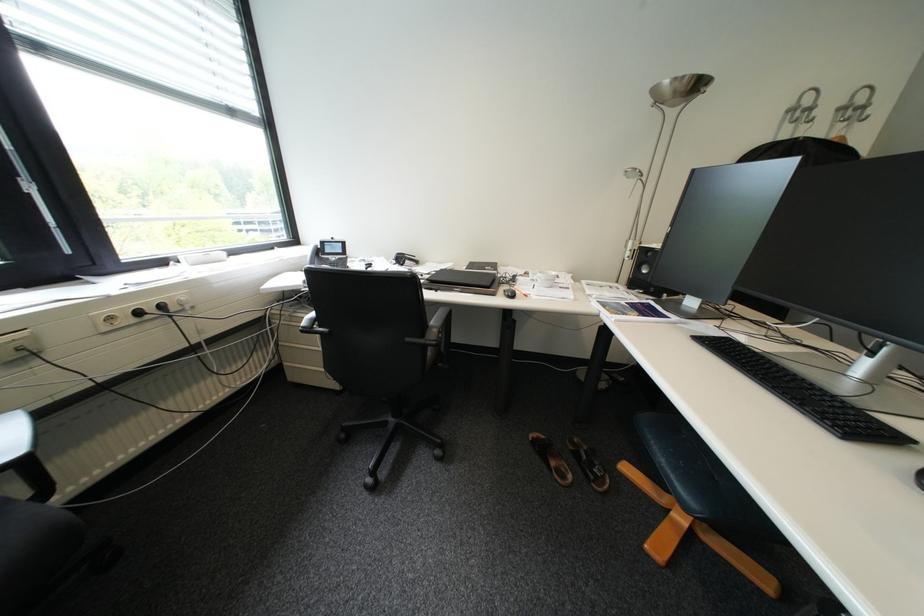
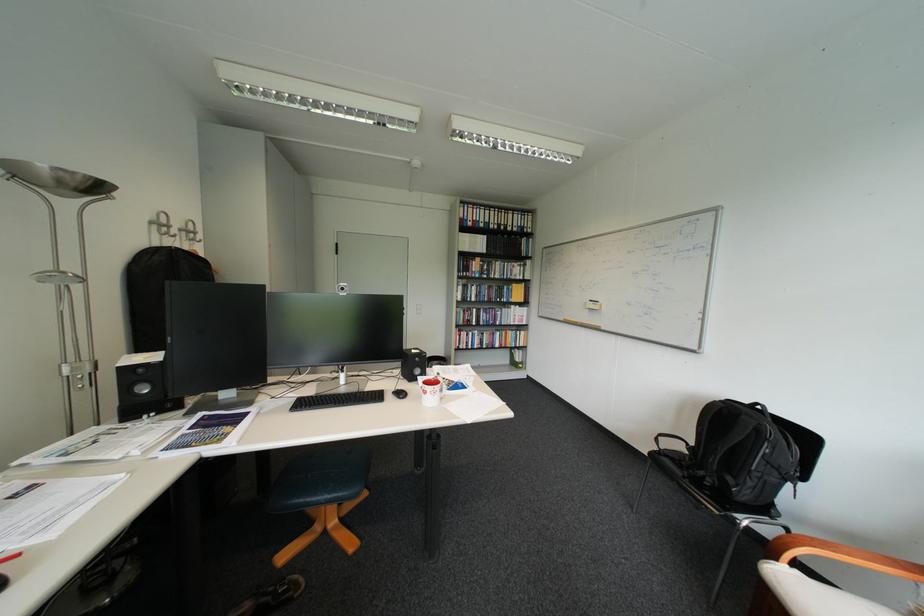
Find the pixel in the second image that matches (808,376) in the first image.

(357, 394)